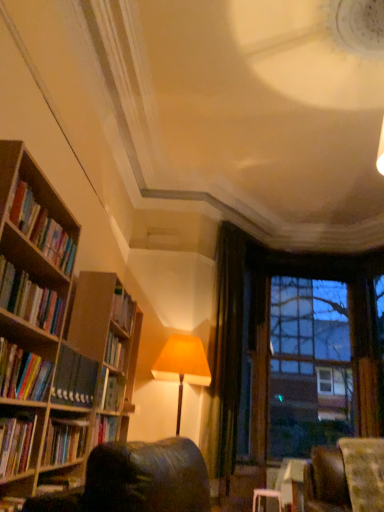
Question: From the image's perspective, is hardcover books at left, the 3th book positioned from the top, located above or below brown wooden window frame at upper right?

Choices:
 (A) below
 (B) above

Answer: (B)

Question: In the image, is hardcover books at left, positioned as the third book in bottom-to-top order, positioned in front of or behind brown wooden window frame at upper right?

Choices:
 (A) front
 (B) behind

Answer: (A)

Question: Based on their relative distances, which object is farther from the velvet green swivel chair at lower right?

Choices:
 (A) hardcover books at left, which is the 2th book from top to bottom
 (B) hardcover book at left, the fifth book in the top-to-bottom sequence
 (C) hardcover books at left, which is the fourth book from top to bottom
 (D) matte yellow lampshade at center
 (E) hardcover books at left, which appears as the first book when viewed from the top

Answer: (E)

Question: Considering the real-world distances, which object is farthest from the brown wooden window frame at upper right?

Choices:
 (A) hardcover books at left, which is the fourth book from top to bottom
 (B) hardcover book at left, the fifth book in the top-to-bottom sequence
 (C) green velvet curtain at center
 (D) velvet green swivel chair at lower right
 (E) hardcover books at left, positioned as the third book in bottom-to-top order

Answer: (B)